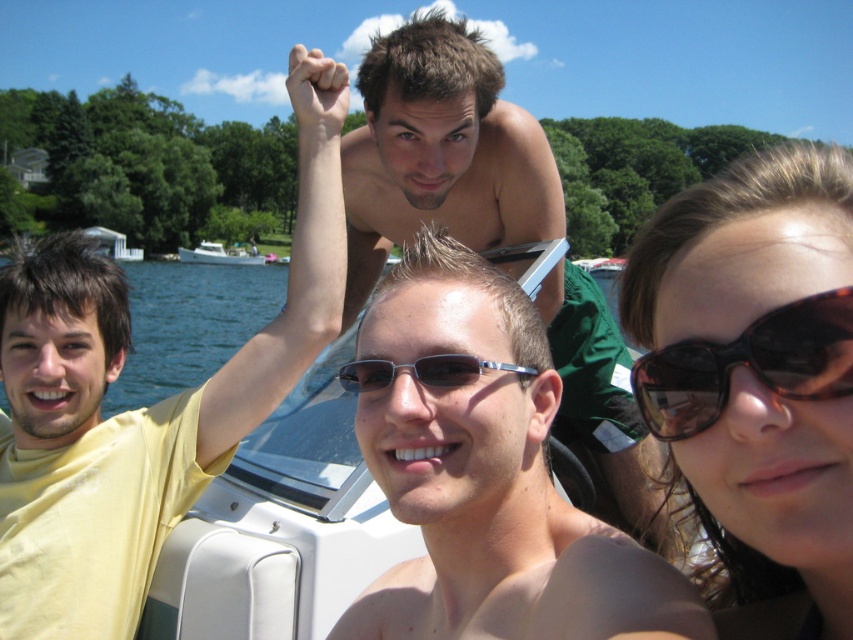
Question: Which of the following is the farthest from the observer?

Choices:
 (A) (184, 253)
 (B) (688, 253)

Answer: (A)

Question: Does brown hair at upper right have a lesser width compared to sunglasses at center?

Choices:
 (A) no
 (B) yes

Answer: (A)

Question: Which point is closer to the camera?

Choices:
 (A) sunglasses at center
 (B) white glossy boat at center
 (C) yellow t-shirt at upper left

Answer: (A)

Question: Can you confirm if brown hair at upper right is positioned to the right of black acetate sunglasses at upper right?

Choices:
 (A) yes
 (B) no

Answer: (A)

Question: Does black acetate sunglasses at upper right appear under white glossy boat at center?

Choices:
 (A) yes
 (B) no

Answer: (A)

Question: Which of the following is the farthest from the observer?

Choices:
 (A) (140, 460)
 (B) (809, 362)
 (C) (759, 588)
 (D) (224, 259)

Answer: (D)